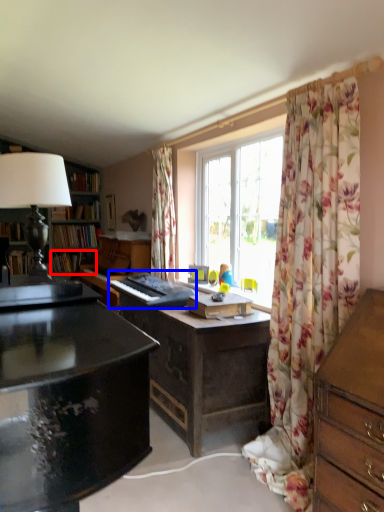
Question: Which of the following is the farthest to the observer, book (highlighted by a red box) or piano (highlighted by a blue box)?

Choices:
 (A) book
 (B) piano

Answer: (A)